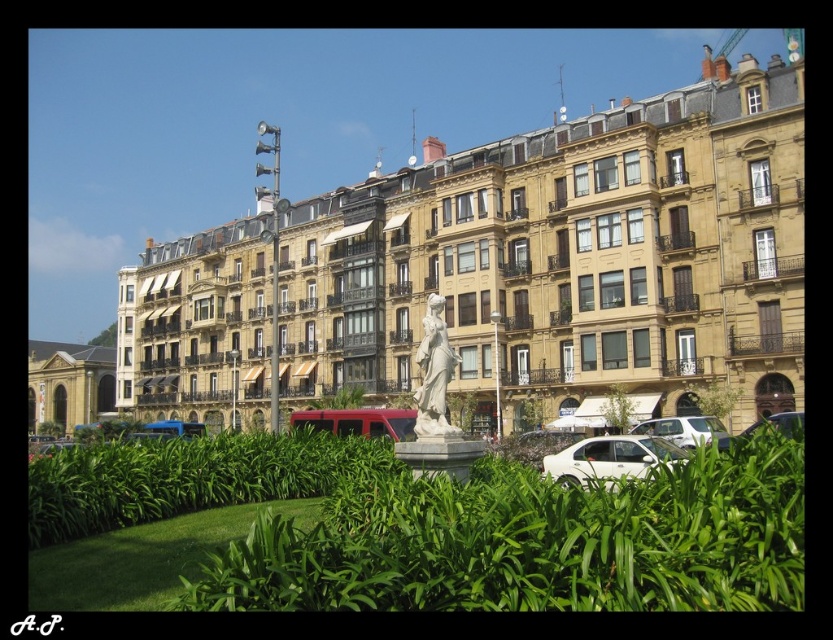
Question: Can you confirm if green leafy plants at center is thinner than white marble statue at center?

Choices:
 (A) yes
 (B) no

Answer: (B)

Question: Is green leafy plants at center to the left of white glossy car at center-right from the viewer's perspective?

Choices:
 (A) yes
 (B) no

Answer: (A)

Question: Can you confirm if green leafy shrubs at center is positioned to the left of white glossy car at center-right?

Choices:
 (A) yes
 (B) no

Answer: (A)

Question: Which point is farther from the camera taking this photo?

Choices:
 (A) (756, 448)
 (B) (606, 452)
 (C) (782, 420)

Answer: (C)

Question: Which object appears farthest from the camera in this image?

Choices:
 (A) white matte car at lower right
 (B) green leafy shrubs at center

Answer: (B)

Question: Which point is closer to the camera taking this photo?

Choices:
 (A) (769, 419)
 (B) (357, 435)

Answer: (A)